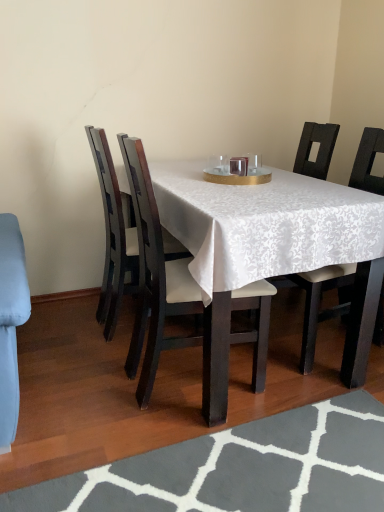
The image size is (384, 512). What are the coordinates of `free point behind gray textured rug at lower center` in the screenshot? It's located at (233, 383).